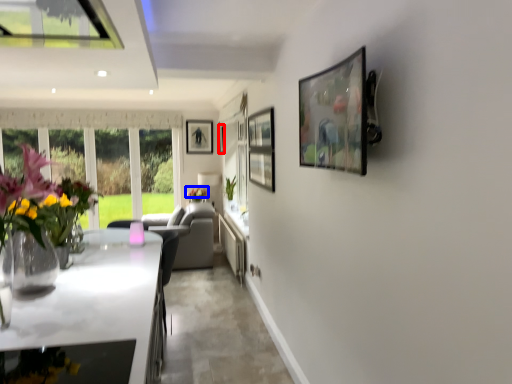
Question: Among these objects, which one is nearest to the camera, picture frame (highlighted by a red box) or flower (highlighted by a blue box)?

Choices:
 (A) picture frame
 (B) flower

Answer: (B)